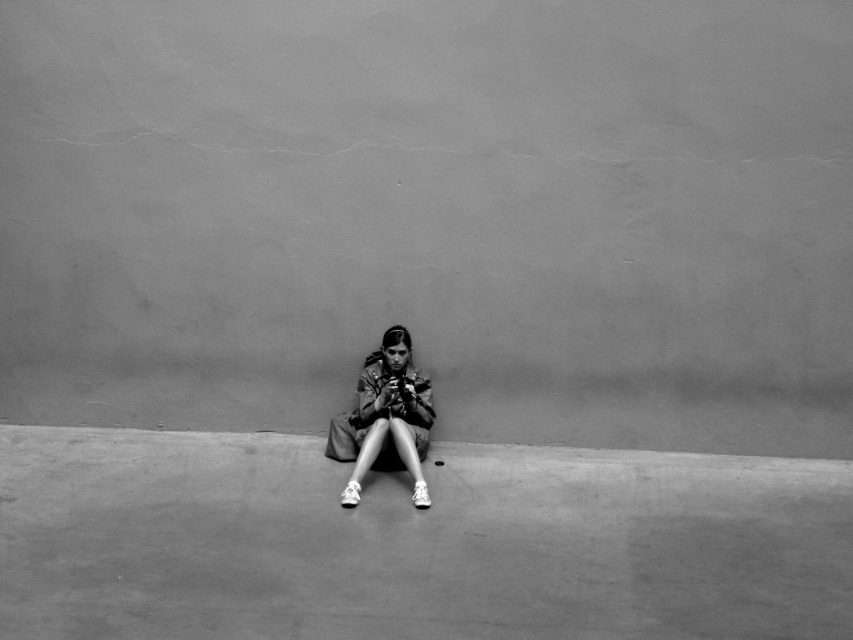
Question: Which point is closer to the camera taking this photo?

Choices:
 (A) (500, 476)
 (B) (424, 412)

Answer: (A)

Question: Is the position of smooth concrete at center more distant than that of matte brown jacket at center?

Choices:
 (A) no
 (B) yes

Answer: (A)

Question: Can you confirm if smooth concrete at center is positioned above matte brown jacket at center?

Choices:
 (A) no
 (B) yes

Answer: (A)

Question: Is smooth concrete at center bigger than matte brown jacket at center?

Choices:
 (A) yes
 (B) no

Answer: (A)

Question: Which object is farther from the camera taking this photo?

Choices:
 (A) smooth concrete at center
 (B) matte brown jacket at center

Answer: (B)